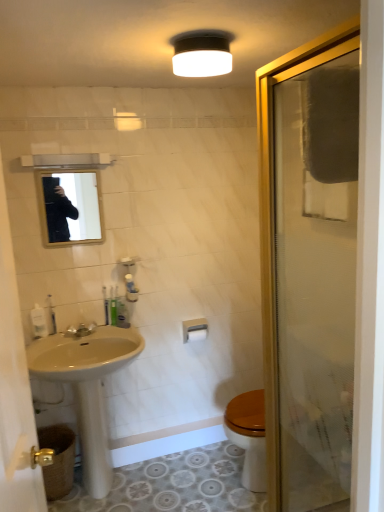
Question: From the image's perspective, is matte silver faucet at lower left on top of clear glass shower door at right?

Choices:
 (A) yes
 (B) no

Answer: (B)

Question: Is matte silver faucet at lower left wider than clear glass shower door at right?

Choices:
 (A) yes
 (B) no

Answer: (B)

Question: Is matte silver faucet at lower left completely or partially outside of clear glass shower door at right?

Choices:
 (A) yes
 (B) no

Answer: (A)

Question: Can you confirm if matte silver faucet at lower left is thinner than clear glass shower door at right?

Choices:
 (A) yes
 (B) no

Answer: (A)

Question: Does matte silver faucet at lower left have a larger size compared to clear glass shower door at right?

Choices:
 (A) yes
 (B) no

Answer: (B)

Question: Is there a large distance between matte silver faucet at lower left and clear glass shower door at right?

Choices:
 (A) no
 (B) yes

Answer: (B)

Question: Is green plastic toothbrush at lower left, the 3th toiletry from the left, with white matte toilet paper at lower center?

Choices:
 (A) no
 (B) yes

Answer: (A)

Question: Does green plastic toothbrush at lower left, acting as the first toiletry starting from the right, have a larger size compared to white matte toilet paper at lower center?

Choices:
 (A) no
 (B) yes

Answer: (A)

Question: From a real-world perspective, is green plastic toothbrush at lower left, the 3th toiletry from the left, under white matte toilet paper at lower center?

Choices:
 (A) no
 (B) yes

Answer: (A)

Question: From a real-world perspective, is green plastic toothbrush at lower left, acting as the first toiletry starting from the right, on top of white matte toilet paper at lower center?

Choices:
 (A) yes
 (B) no

Answer: (A)

Question: Is green plastic toothbrush at lower left, acting as the first toiletry starting from the right, wider than white matte toilet paper at lower center?

Choices:
 (A) no
 (B) yes

Answer: (A)

Question: Is green plastic toothbrush at lower left, the 3th toiletry from the left, aimed at white matte toilet paper at lower center?

Choices:
 (A) yes
 (B) no

Answer: (B)

Question: Can you confirm if translucent plastic soap dispenser at lower left, the 1th toiletry positioned from the left, is bigger than white matte towel bar at center?

Choices:
 (A) yes
 (B) no

Answer: (B)